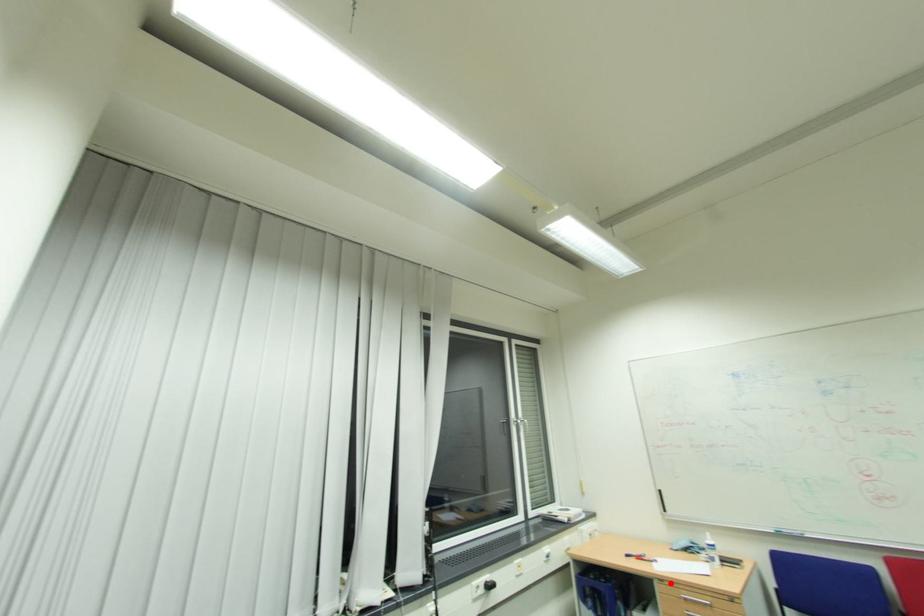
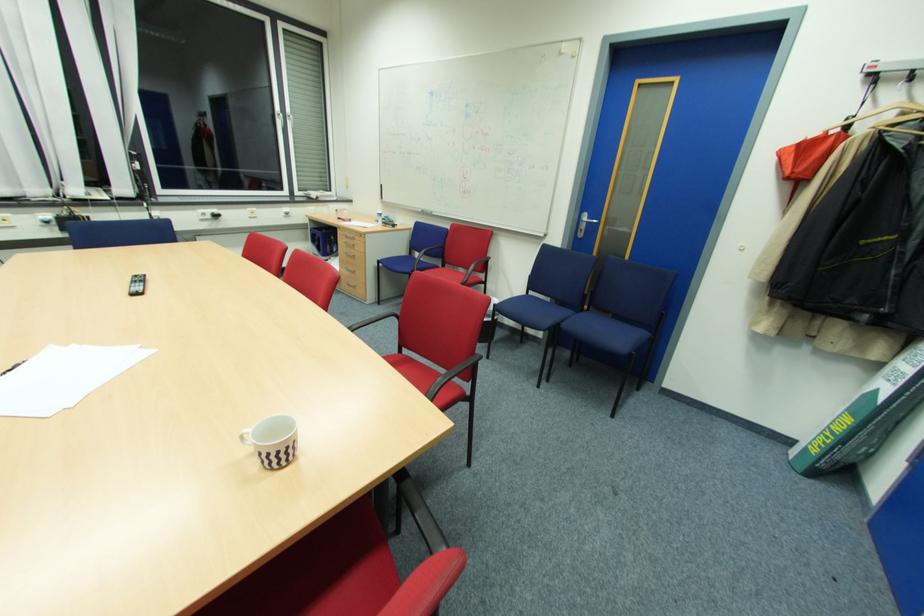
Locate, in the second image, the point that corresponds to the highlighted location in the first image.

(344, 229)